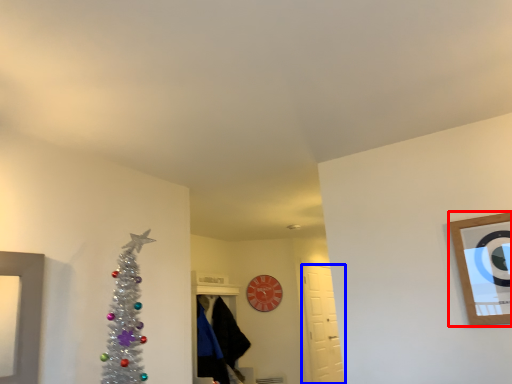
Question: Which object appears farthest to the camera in this image, picture frame (highlighted by a red box) or door (highlighted by a blue box)?

Choices:
 (A) picture frame
 (B) door

Answer: (B)